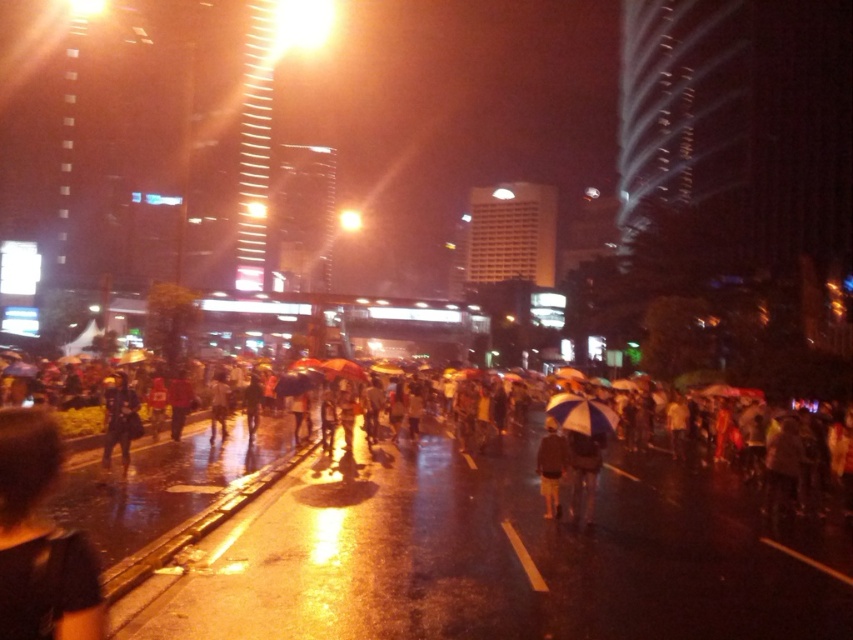
Is dark gray umbrella at center taller than dark brown leather jacket at center?

Correct, dark gray umbrella at center is much taller as dark brown leather jacket at center.

Consider the image. Can you confirm if dark gray umbrella at center is wider than dark brown leather jacket at center?

Correct, the width of dark gray umbrella at center exceeds that of dark brown leather jacket at center.

Does point (160, 520) lie in front of point (555, 509)?

Yes.

At what (x,y) coordinates should I click in order to perform the action: click on dark gray umbrella at center. Please return your answer as a coordinate pair (x, y). This screenshot has width=853, height=640. Looking at the image, I should click on (126, 496).

Is dark blue jacket at left behind dark brown leather jacket at center?

Yes, it is.

Is point (126, 422) positioned after point (553, 467)?

Yes.

Image resolution: width=853 pixels, height=640 pixels. Identify the location of dark blue jacket at left. (120, 419).

Can you confirm if dark gray umbrella at center is positioned below white matte umbrella at center?

Correct, dark gray umbrella at center is located below white matte umbrella at center.

Which is behind, point (682, 472) or point (606, 404)?

Point (606, 404)

Is point (248, 452) closer to camera compared to point (582, 420)?

No, it is behind (582, 420).

You are a GUI agent. You are given a task and a screenshot of the screen. Output one action in this format:
    pyautogui.click(x=<x>, y=<y>)
    Task: Click on the dark gray umbrella at center
    This screenshot has height=640, width=853.
    Given the screenshot: What is the action you would take?
    pyautogui.click(x=126, y=496)